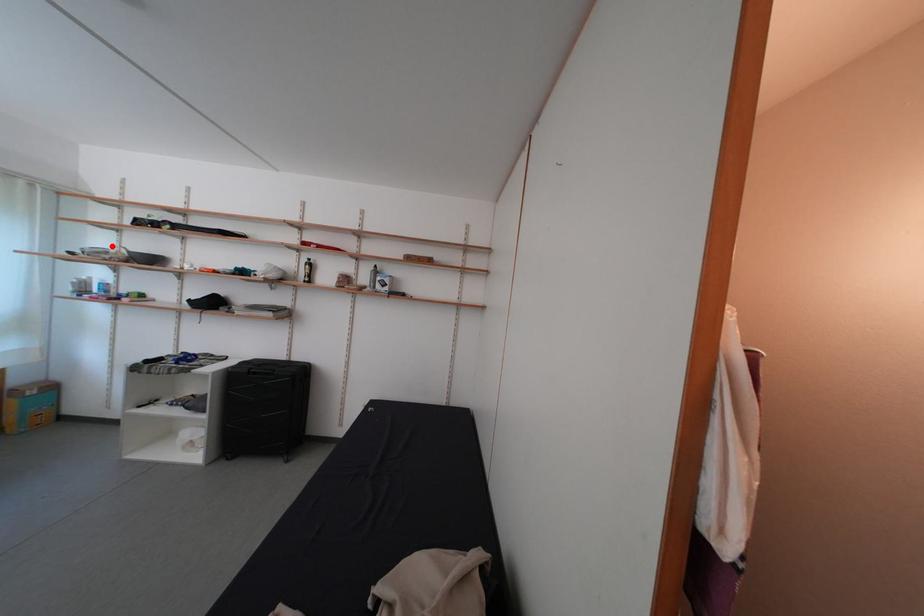
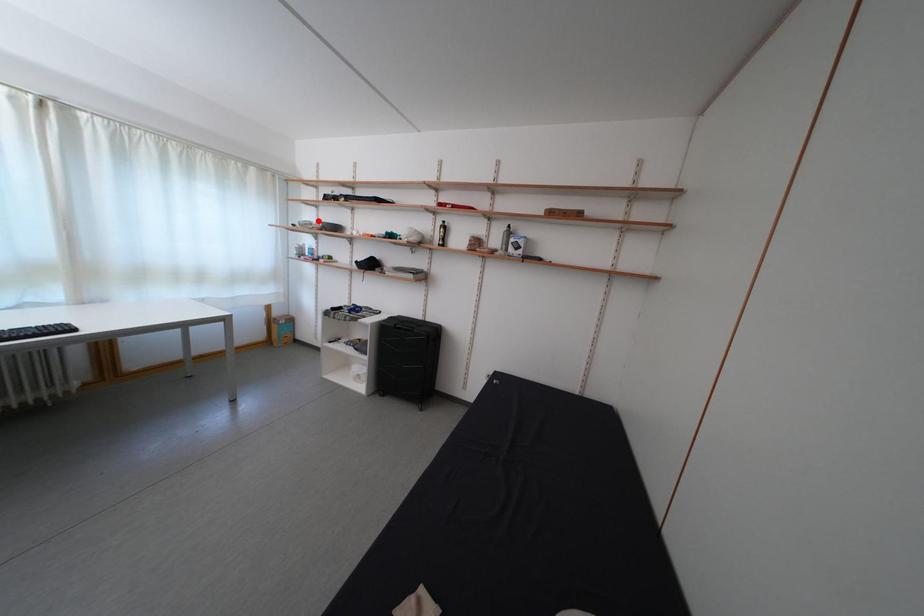
I am providing you with two images of the same scene from different viewpoints. A red point is marked on the first image and another point is marked on the second image. Do the highlighted points in image1 and image2 indicate the same real-world spot?

Yes